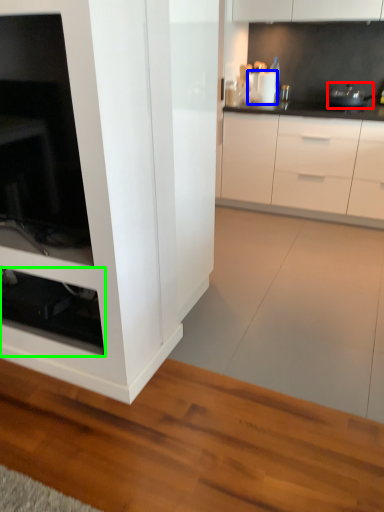
Question: Which is farther away from appliance (highlighted by a red box)? appliance (highlighted by a blue box) or shelf (highlighted by a green box)?

Choices:
 (A) appliance
 (B) shelf

Answer: (B)